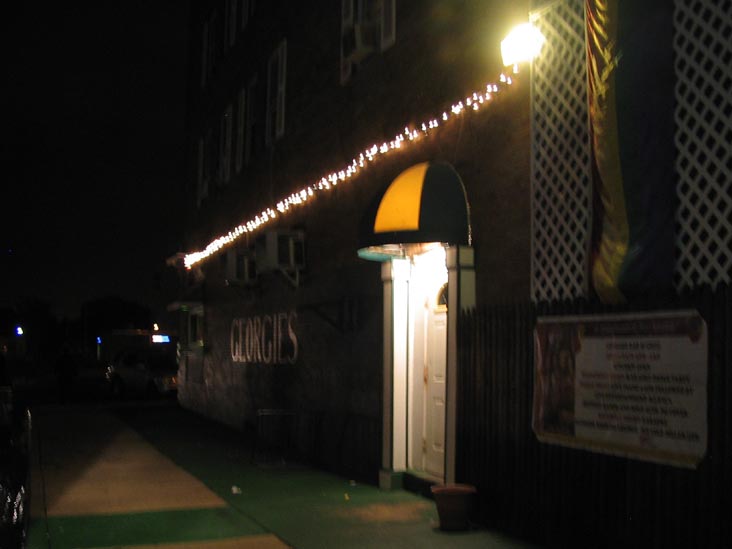
I want to click on door, so click(x=436, y=413).